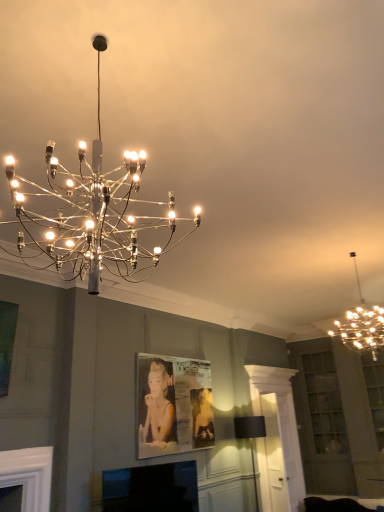
Question: From a real-world perspective, is metallic silver picture frame at center beneath metallic chandelier at upper center, placed as the 3th lamp when sorted from bottom to top?

Choices:
 (A) no
 (B) yes

Answer: (B)

Question: From the image's perspective, is metallic silver picture frame at center located above metallic chandelier at upper center, which is counted as the third lamp, starting from the right?

Choices:
 (A) no
 (B) yes

Answer: (A)

Question: Is metallic silver picture frame at center positioned with its back to metallic chandelier at upper center, the 1th lamp from the left?

Choices:
 (A) yes
 (B) no

Answer: (B)

Question: From the image's perspective, is metallic silver picture frame at center beneath metallic chandelier at upper center, the 1th lamp from the left?

Choices:
 (A) no
 (B) yes

Answer: (B)

Question: Is the position of metallic silver picture frame at center more distant than that of metallic chandelier at upper center, the 1th lamp from the left?

Choices:
 (A) no
 (B) yes

Answer: (B)

Question: From a real-world perspective, is metallic silver picture frame at center positioned over metallic chandelier at upper center, which is counted as the 1th lamp, starting from the top, based on gravity?

Choices:
 (A) no
 (B) yes

Answer: (A)

Question: Could metallic silver picture frame at center be considered to be inside metallic chandelier at upper right, marked as the second lamp in a bottom-to-top arrangement?

Choices:
 (A) yes
 (B) no

Answer: (B)

Question: Does metallic chandelier at upper right, which appears as the second lamp when viewed from the back, come behind metallic silver picture frame at center?

Choices:
 (A) no
 (B) yes

Answer: (A)

Question: Can you confirm if metallic chandelier at upper right, marked as the second lamp in a bottom-to-top arrangement, is shorter than metallic silver picture frame at center?

Choices:
 (A) yes
 (B) no

Answer: (A)

Question: From a real-world perspective, is metallic chandelier at upper right, arranged as the 2th lamp when viewed from the top, physically below metallic silver picture frame at center?

Choices:
 (A) no
 (B) yes

Answer: (A)

Question: Considering the relative sizes of metallic chandelier at upper right, marked as the second lamp in a bottom-to-top arrangement, and metallic silver picture frame at center in the image provided, is metallic chandelier at upper right, marked as the second lamp in a bottom-to-top arrangement, taller than metallic silver picture frame at center?

Choices:
 (A) yes
 (B) no

Answer: (B)

Question: From the image's perspective, is metallic chandelier at upper right, the second lamp from the front, on metallic silver picture frame at center?

Choices:
 (A) no
 (B) yes

Answer: (B)

Question: Is metallic silver picture frame at center completely or partially outside of metallic chandelier at upper right, which ranks as the 3th lamp in left-to-right order?

Choices:
 (A) no
 (B) yes

Answer: (B)